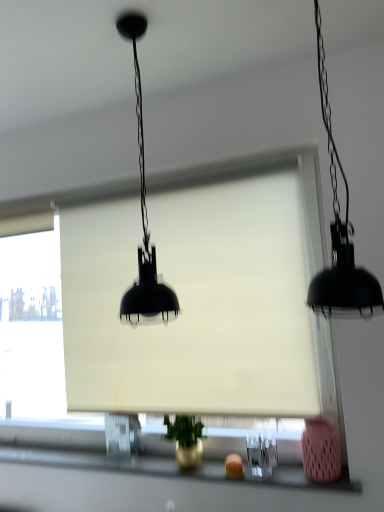
Question: In the image, is black matte pendant light at right, the 1th lamp viewed from the right, positioned in front of or behind metallic gold vase at lower center?

Choices:
 (A) front
 (B) behind

Answer: (A)

Question: From the image's perspective, relative to metallic gold vase at lower center, is black matte pendant light at right, which is the second lamp in left-to-right order, above or below?

Choices:
 (A) below
 (B) above

Answer: (B)

Question: Estimate the real-world distances between objects in this image. Which object is farther from the black matte pendant light at right, which is the second lamp in left-to-right order?

Choices:
 (A) white matte window screen at center
 (B) metallic gold vase at lower center
 (C) matte black lampshade at center, marked as the 2th lamp in a right-to-left arrangement

Answer: (B)

Question: Estimate the real-world distances between objects in this image. Which object is closer to the white matte window screen at center?

Choices:
 (A) metallic gold vase at lower center
 (B) matte black lampshade at center, marked as the 2th lamp in a right-to-left arrangement
 (C) black matte pendant light at right, the 1th lamp viewed from the right

Answer: (B)